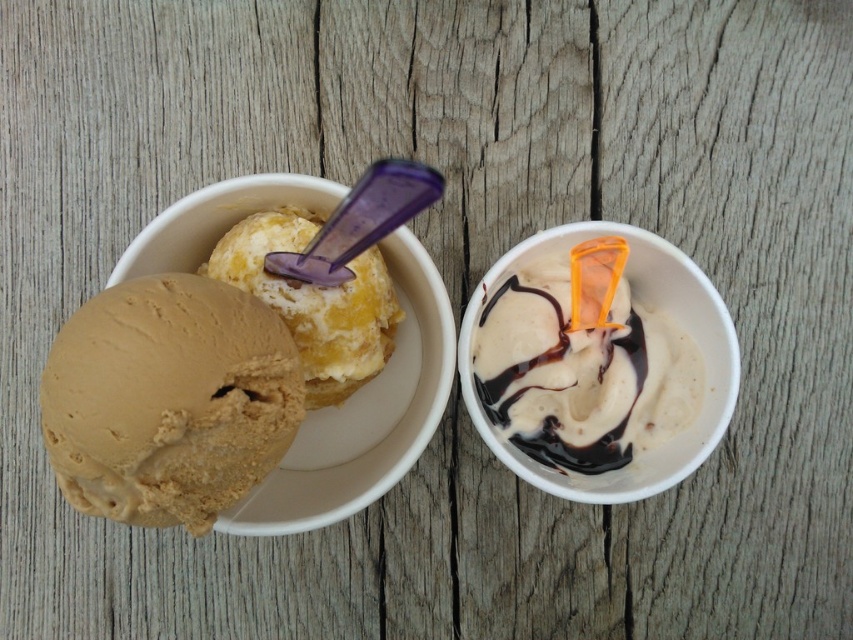
Between point (312, 500) and point (613, 454), which one is positioned behind?

The point (613, 454) is more distant.

Based on the photo, which is more to the right, matte plastic bowl at upper left or white glossy ice cream at center?

From the viewer's perspective, white glossy ice cream at center appears more on the right side.

Find the location of a particular element. The image size is (853, 640). matte plastic bowl at upper left is located at coordinates (364, 417).

Can you confirm if golden brown ice cream at left is thinner than matte plastic bowl at upper left?

Correct, golden brown ice cream at left's width is less than matte plastic bowl at upper left's.

Who is shorter, golden brown ice cream at left or matte plastic bowl at upper left?

golden brown ice cream at left

Between point (195, 449) and point (189, 268), which one is positioned in front?

Positioned in front is point (195, 449).

The image size is (853, 640). What are the coordinates of `golden brown ice cream at left` in the screenshot? It's located at (167, 401).

Is golden brown ice cream at left to the right of vanilla ice cream at upper left from the viewer's perspective?

In fact, golden brown ice cream at left is to the left of vanilla ice cream at upper left.

Which is more to the left, golden brown ice cream at left or vanilla ice cream at upper left?

golden brown ice cream at left

Locate an element on the screen. golden brown ice cream at left is located at coordinates (167, 401).